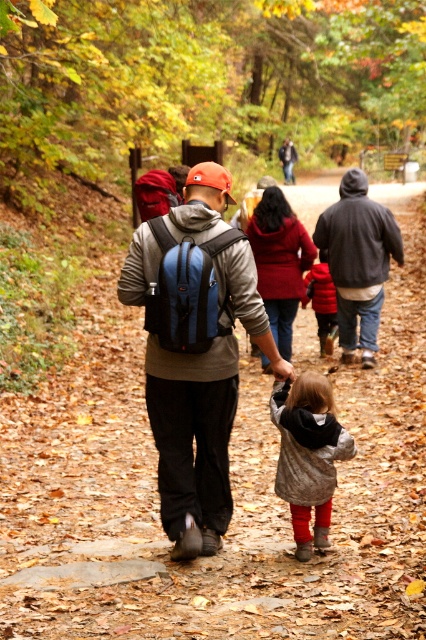
You are a hiker planning to carry both the matte blue backpack at center and the gray wool coat at center. Based on their sizes, which item should you place first in your storage compartment to maximize space efficiency?

Since the matte blue backpack at center is taller than the gray wool coat at center, you should place the matte blue backpack at center first to utilize vertical space effectively.

You are a hiker who wants to know if you can safely walk between the gray wool coat at center and the red fleece jacket at center without stepping on the fallen leaves. The path between them is 4.17 meters wide. If your backpack is 2 meters wide, can you pass through?

The path between the gray wool coat at center and the red fleece jacket at center is 4.17 meters wide. Since your backpack is 2 meters wide, you can safely pass through the path without stepping on the fallen leaves.

You are a photographer trying to capture a candid shot of the two people walking in the forest. You want to ensure the dark gray hoodie at center and the red fleece jacket at center are both in the frame. Based on their positions, which one should you focus on first to ensure they are both visible?

Since the dark gray hoodie at center is to the right of the red fleece jacket at center, you should focus on the red fleece jacket at center first to ensure both are visible in the frame.